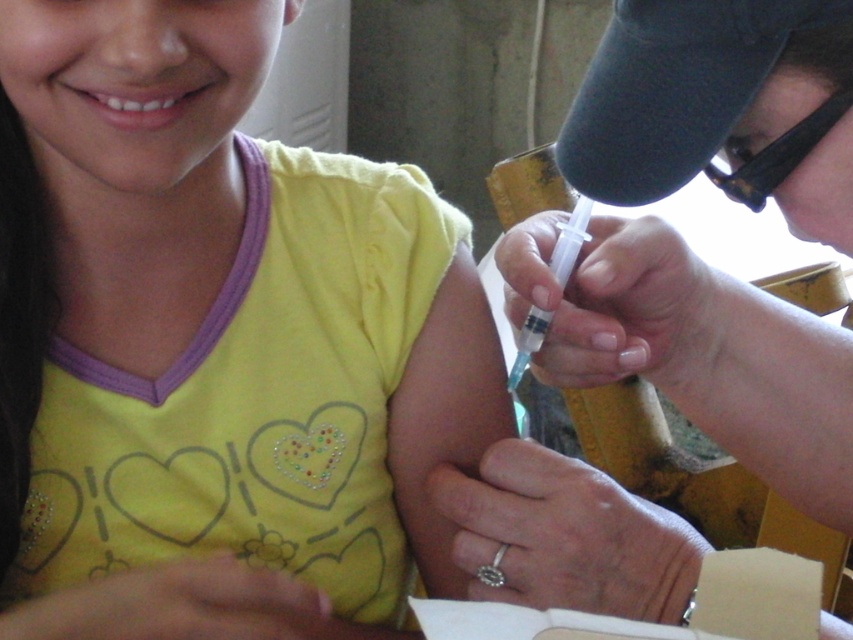
Question: Is the position of matte plastic syringe at upper right less distant than that of black plastic goggles at upper right?

Choices:
 (A) yes
 (B) no

Answer: (A)

Question: Which object is positioned closest to the yellow matte shirt at upper center?

Choices:
 (A) matte plastic syringe at upper right
 (B) black plastic goggles at upper right

Answer: (A)

Question: Is matte plastic syringe at upper right further to camera compared to black plastic goggles at upper right?

Choices:
 (A) yes
 (B) no

Answer: (B)

Question: Which object is the farthest from the matte plastic syringe at upper right?

Choices:
 (A) yellow matte shirt at upper center
 (B) black plastic goggles at upper right

Answer: (A)

Question: Is yellow matte shirt at upper center above matte plastic syringe at upper right?

Choices:
 (A) yes
 (B) no

Answer: (B)

Question: Among these points, which one is nearest to the camera?

Choices:
 (A) click(x=801, y=380)
 (B) click(x=840, y=99)
 (C) click(x=142, y=432)

Answer: (B)